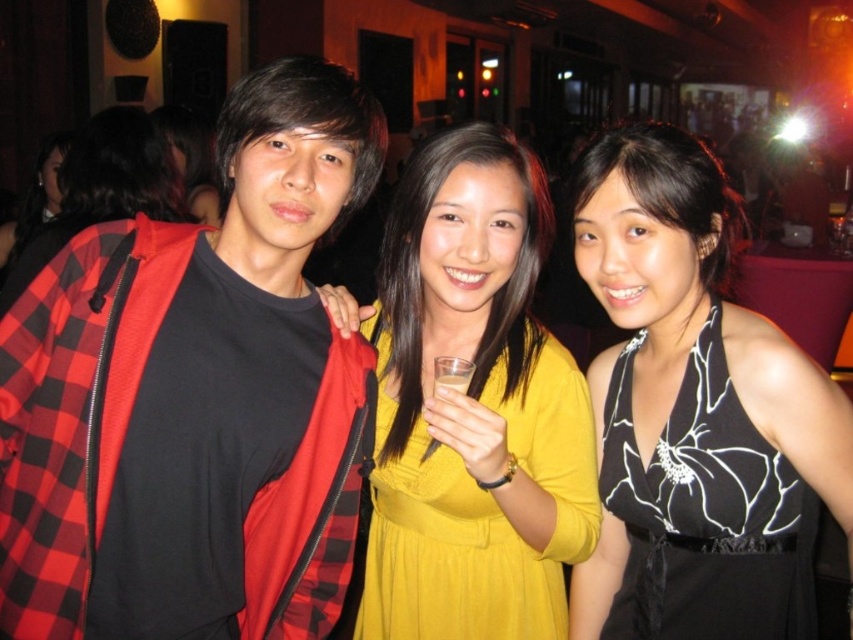
Question: Can you confirm if black satin dress at center is positioned to the left of clear plastic glass at center?

Choices:
 (A) no
 (B) yes

Answer: (A)

Question: Is red plaid jacket at center below yellow matte dress at center?

Choices:
 (A) no
 (B) yes

Answer: (B)

Question: Considering the real-world distances, which object is farthest from the black satin dress at center?

Choices:
 (A) yellow matte dress at center
 (B) yellow satin dress at center
 (C) clear plastic glass at center
 (D) translucent plastic cup at center

Answer: (A)

Question: Among these objects, which one is farthest from the camera?

Choices:
 (A) yellow matte dress at center
 (B) clear plastic glass at center
 (C) yellow satin dress at center
 (D) red plaid jacket at center

Answer: (A)

Question: Is black satin dress at center bigger than translucent plastic cup at center?

Choices:
 (A) no
 (B) yes

Answer: (B)

Question: Estimate the real-world distances between objects in this image. Which object is farther from the yellow matte dress at center?

Choices:
 (A) translucent plastic cup at center
 (B) yellow satin dress at center
 (C) clear plastic glass at center
 (D) black satin dress at center

Answer: (A)